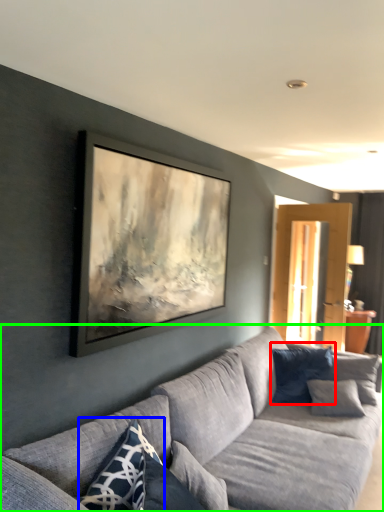
Question: Based on their relative distances, which object is farther from pillow (highlighted by a red box)? Choose from pillow (highlighted by a blue box) and studio couch (highlighted by a green box).

Choices:
 (A) pillow
 (B) studio couch

Answer: (A)